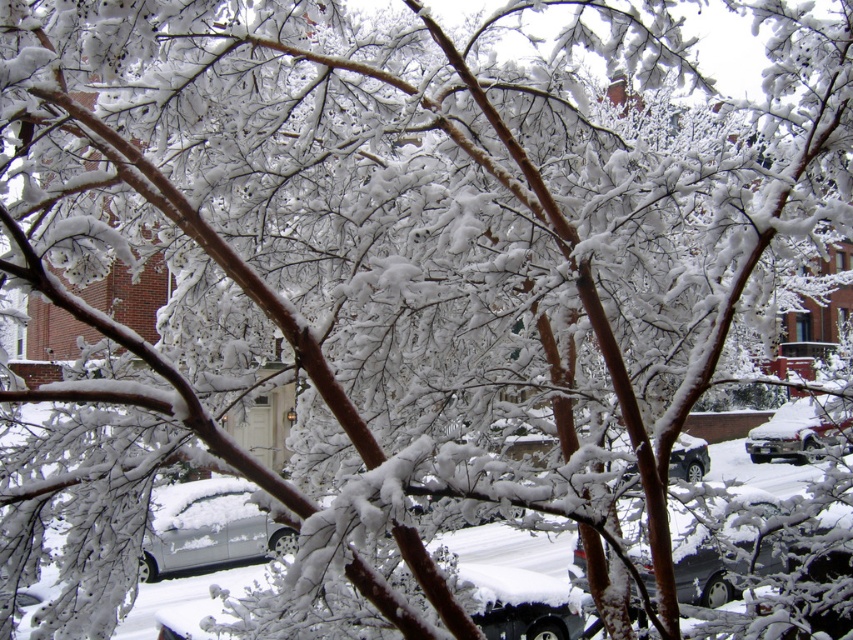
Question: Which point is farther from the camera taking this photo?

Choices:
 (A) (677, 458)
 (B) (796, 445)
 (C) (155, 540)

Answer: (B)

Question: Is silver metallic suv at lower right to the left of black matte suv at center from the viewer's perspective?

Choices:
 (A) no
 (B) yes

Answer: (A)

Question: Which object is the closest to the silver metallic car at lower left?

Choices:
 (A) black matte suv at center
 (B) silver metallic suv at lower right

Answer: (A)

Question: Which point is farther to the camera?

Choices:
 (A) (628, 470)
 (B) (755, 426)
 (C) (236, 508)

Answer: (B)

Question: Does silver metallic car at lower left have a lesser width compared to silver metallic suv at lower right?

Choices:
 (A) no
 (B) yes

Answer: (B)

Question: Is the position of silver metallic car at lower left less distant than that of black matte suv at center?

Choices:
 (A) no
 (B) yes

Answer: (A)